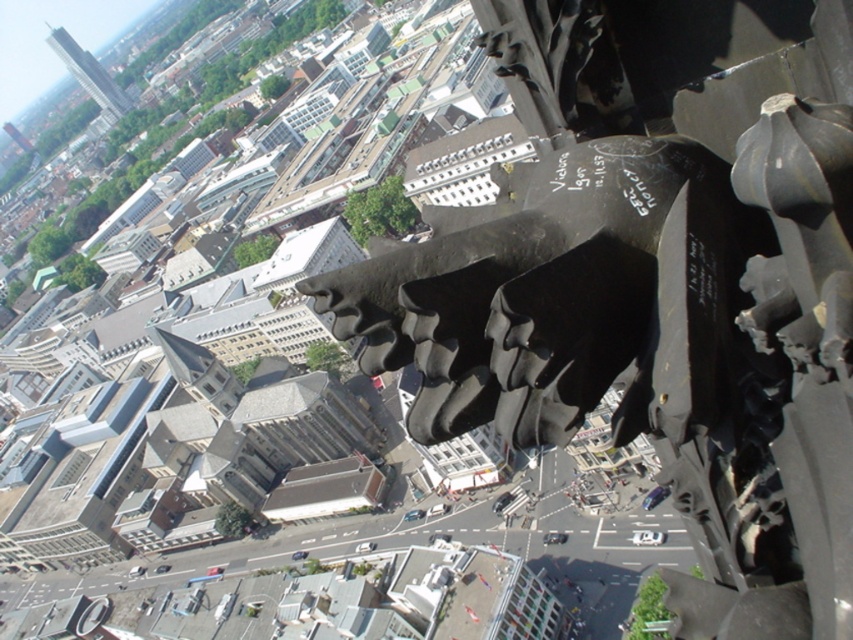
You are a drone operator flying a drone that is 1 meter wide. You need to navigate your drone from the black stone gargoyle at upper center to the smooth glass tower at upper left. Considering their positions, will your drone fit through the space between them?

The black stone gargoyle at upper center is closer to the viewer than the smooth glass tower at upper left. Since the gargoyle is closer, the distance between them might not be sufficient for the drone to pass through. However, without specific measurements of the space between them, it is impossible to determine if the 1 meter wide drone can fit. Additional spatial data is required to confirm feasibility.

You are a drone operator who needs to fly a drone from the black stone gargoyle at upper center to the nearest building with a flat roof. The drone has a maximum flight range of 20 meters. Can the drone reach the building?

The distance between the black stone gargoyle at upper center and the nearest building with a flat roof is 23.05 meters, which exceeds the drone operator maximum flight range of 20 meters. The drone cannot reach the building.

You are a drone operator who needs to fly a drone from the black stone gargoyle at upper center to the smooth glass tower at upper left. The drone has a maximum flight range of 2000 feet. Can the drone complete the journey without needing to recharge?

The distance between the black stone gargoyle at upper center and the smooth glass tower at upper left is 1970.18 feet, which is within the drone operator drone maximum flight range of 2000 feet. Yes, the drone can complete the journey without needing to recharge.